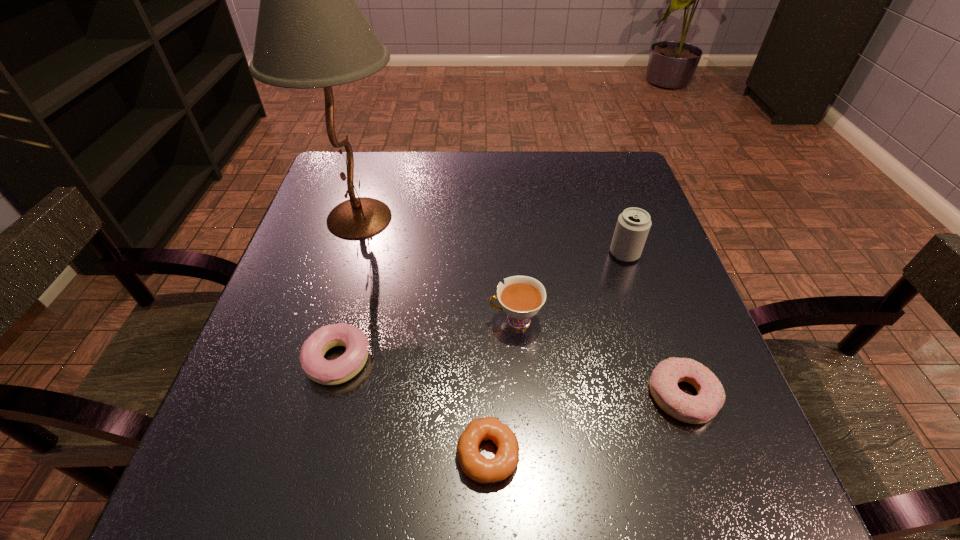
Locate an element on the screen. The width and height of the screenshot is (960, 540). free space that satisfies the following two spatial constraints: 1. on the back side of the second doughnut from left to right; 2. on the left side of the fifth shortest object is located at coordinates (485, 253).

Find the location of a particular element. The height and width of the screenshot is (540, 960). free region that satisfies the following two spatial constraints: 1. on the front side of the leftmost doughnut; 2. on the right side of the rightmost doughnut is located at coordinates (329, 396).

The image size is (960, 540). What are the coordinates of `blank space that satisfies the following two spatial constraints: 1. on the front-facing side of the table lamp; 2. on the left side of the leftmost doughnut` in the screenshot? It's located at (316, 361).

Identify the location of free space that satisfies the following two spatial constraints: 1. on the front-facing side of the rightmost doughnut; 2. on the left side of the tallest object. The width and height of the screenshot is (960, 540). coord(305,396).

Identify the location of free spot that satisfies the following two spatial constraints: 1. on the front-facing side of the rightmost doughnut; 2. on the left side of the tallest object. (305, 396).

Where is `free space that satisfies the following two spatial constraints: 1. on the front side of the leftmost doughnut; 2. on the right side of the second doughnut from right to left`? The height and width of the screenshot is (540, 960). free space that satisfies the following two spatial constraints: 1. on the front side of the leftmost doughnut; 2. on the right side of the second doughnut from right to left is located at coordinates (314, 455).

Locate an element on the screen. free point that satisfies the following two spatial constraints: 1. on the front-facing side of the leftmost doughnut; 2. on the left side of the tallest object is located at coordinates (316, 361).